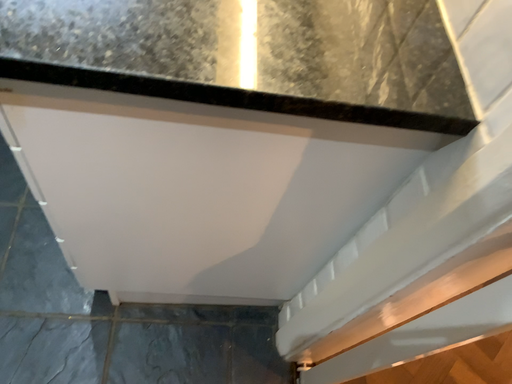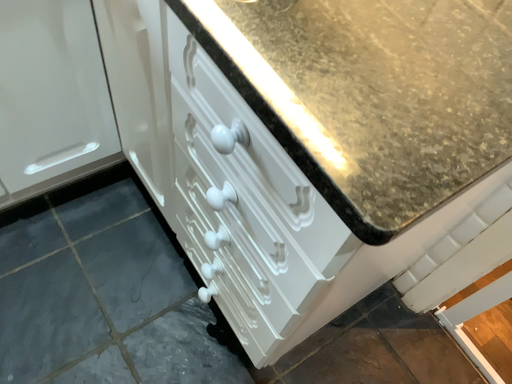
Question: How did the camera likely rotate when shooting the video?

Choices:
 (A) rotated right
 (B) rotated left

Answer: (A)